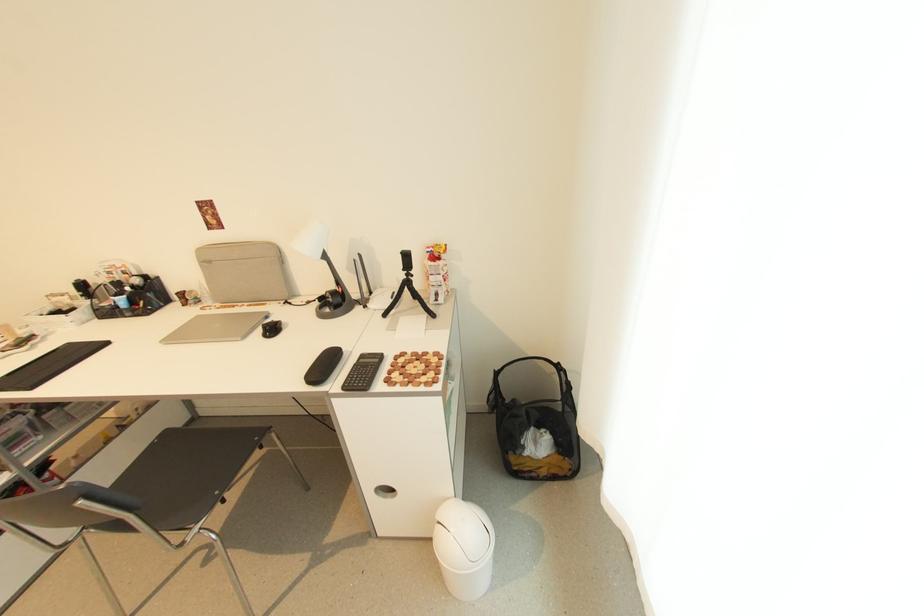
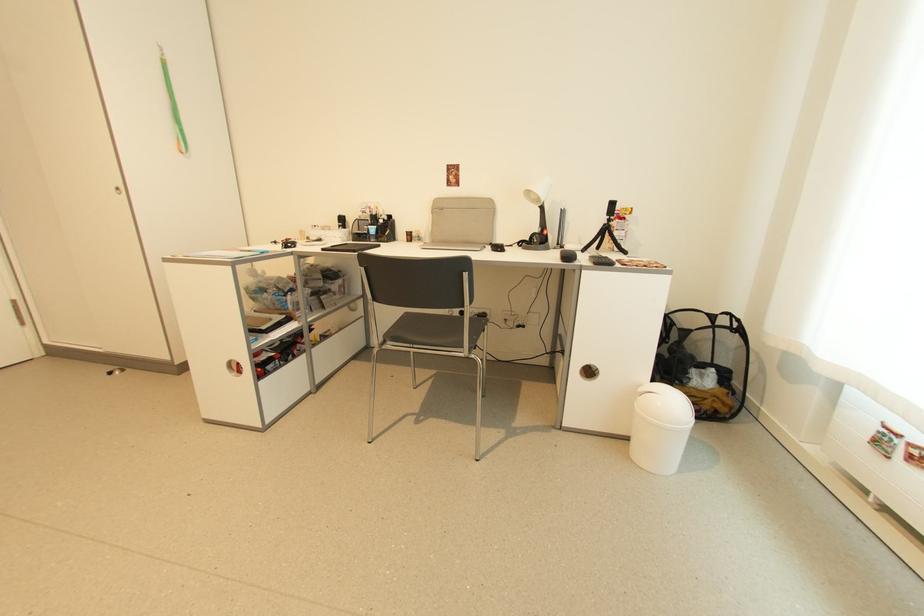
The images are taken continuously from a first-person perspective. In which direction are you moving?

The cameraman moved toward left, backward.